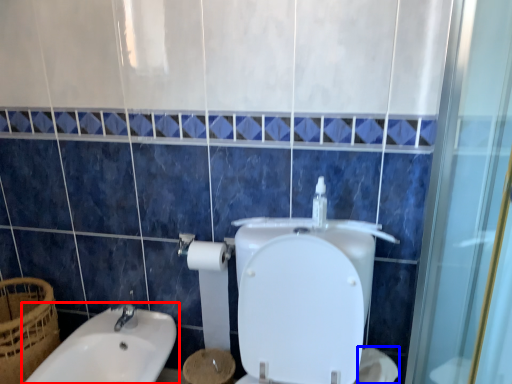
Question: Among these objects, which one is nearest to the camera, sink (highlighted by a red box) or toilet paper (highlighted by a blue box)?

Choices:
 (A) sink
 (B) toilet paper

Answer: (A)